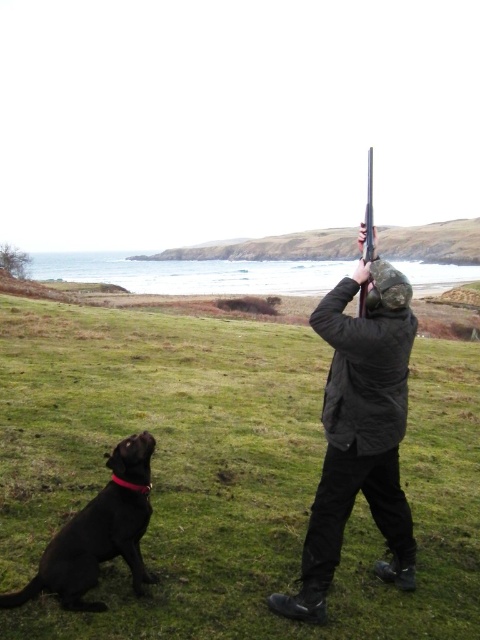
Is green grassy field at center thinner than polished wood shotgun at upper center?

Indeed, green grassy field at center has a lesser width compared to polished wood shotgun at upper center.

Which is behind, point (330, 632) or point (368, 195)?

Positioned behind is point (368, 195).

Where is `green grassy field at center`? The width and height of the screenshot is (480, 640). green grassy field at center is located at coordinates (224, 474).

The height and width of the screenshot is (640, 480). What are the coordinates of `green grassy field at center` in the screenshot? It's located at (224, 474).

Is green grassy field at center to the left of black matte jacket at center from the viewer's perspective?

Incorrect, green grassy field at center is not on the left side of black matte jacket at center.

Is green grassy field at center positioned before black matte jacket at center?

That is True.

Is point (245, 332) more distant than point (323, 401)?

Yes, it is.

Identify the location of green grassy field at center. This screenshot has width=480, height=640. (224, 474).

Is point (1, 387) positioned after point (84, 547)?

Yes, it is.

The width and height of the screenshot is (480, 640). Find the location of `green grassy field at center`. green grassy field at center is located at coordinates click(x=224, y=474).